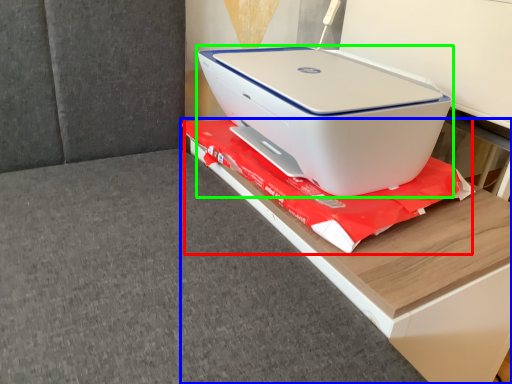
Question: Which object is positioned closest to material (highlighted by a red box)? Select from furniture (highlighted by a blue box) and printer (highlighted by a green box).

Choices:
 (A) furniture
 (B) printer

Answer: (A)